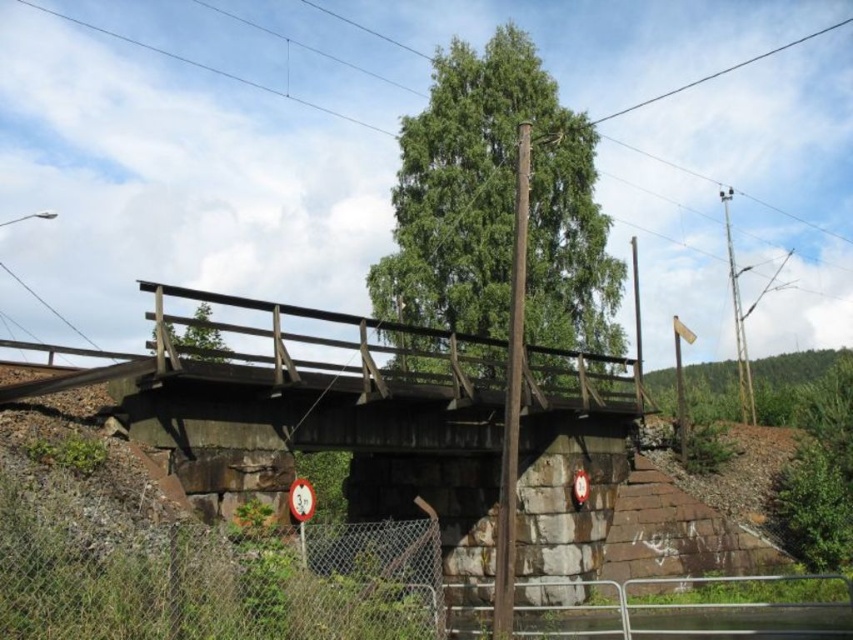
You are a hiker standing on the rustic railway bridge and notice a green matte tree at center and a black wire at upper center. Which object is closer to you, the observer?

The green matte tree at center is closer to you than the black wire at upper center because it is positioned under it.

You are a hiker standing on the rustic railway bridge and want to take a photo of both the green leafy tree at center and the green matte tree at center. Which tree should you focus on first if you want to include both in your frame without moving the camera?

The green leafy tree at center is larger in size than the green matte tree at center, so you should focus on the green leafy tree at center first to ensure it fits in the frame, then adjust to include the smaller green matte tree at center.

You are standing on the bridge and want to take a photo of the green leafy tree at center. Where should you position yourself to capture the tree in the center of your camera frame?

To capture the green leafy tree at center in the center of your camera frame, position yourself at the point corresponding to the tree location, which is at coordinates (498, 205). This ensures the tree is centered in your view.